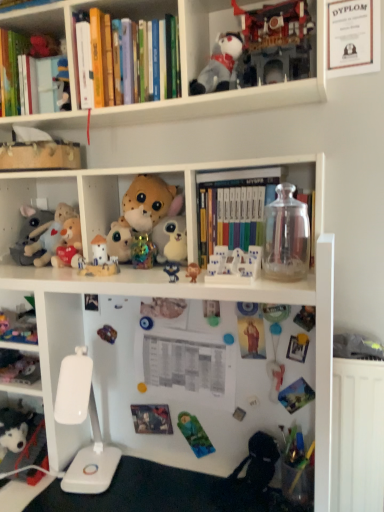
Question: Is point (178, 266) positioned closer to the camera than point (188, 268)?

Choices:
 (A) farther
 (B) closer

Answer: (A)

Question: From the image's perspective, is blue fabric plush at center, which is the sixth toy from bottom to top, above or below brown plush bear at center, the ninth toy from the top?

Choices:
 (A) below
 (B) above

Answer: (A)

Question: Which object is the farthest from the green fabric sleeping bag at lower center, positioned as the 2th toy in bottom-to-top order?

Choices:
 (A) fluffy plush toys at left
 (B) white plush toy at center, arranged as the tenth toy when ordered from the bottom
 (C) transparent glass jar at center, arranged as the third book when viewed from the top
 (D) blue fabric plush at center, which is the sixth toy from bottom to top
 (E) green matte magnet at center, which is counted as the eleventh toy, starting from the top

Answer: (A)

Question: Estimate the real-world distances between objects in this image. Which object is farther from the matte plastic toy at lower left, the twelfth toy in the top-to-bottom sequence?

Choices:
 (A) green matte magnet at center, acting as the 5th toy starting from the bottom
 (B) fluffy plush toys at left
 (C) brown plush bear at center, the ninth toy from the top
 (D) white plush dog at lower left, positioned as the 15th toy in top-to-bottom order
 (E) green fabric sleeping bag at lower center, which is counted as the fourteenth toy, starting from the top

Answer: (C)